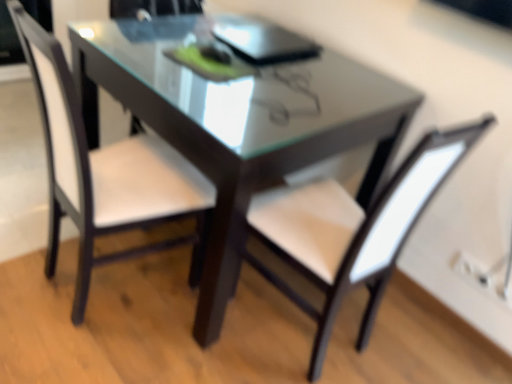
Find the location of a particular element. The image size is (512, 384). vacant area that lies between white leather chair at center, the second chair from the right, and transparent glass table at center is located at coordinates (138, 317).